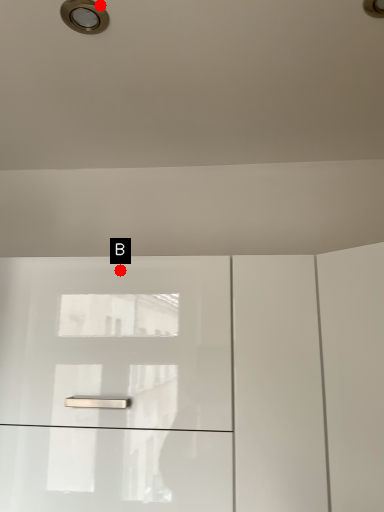
Question: Two points are circled on the image, labeled by A and B beside each circle. Which point appears farthest from the camera in this image?

Choices:
 (A) A is further
 (B) B is further

Answer: (B)